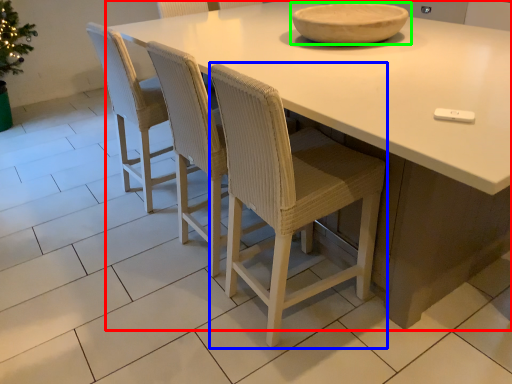
Question: Considering the real-world distances, which object is closest to table (highlighted by a red box)? chair (highlighted by a blue box) or bowl (highlighted by a green box).

Choices:
 (A) chair
 (B) bowl

Answer: (A)